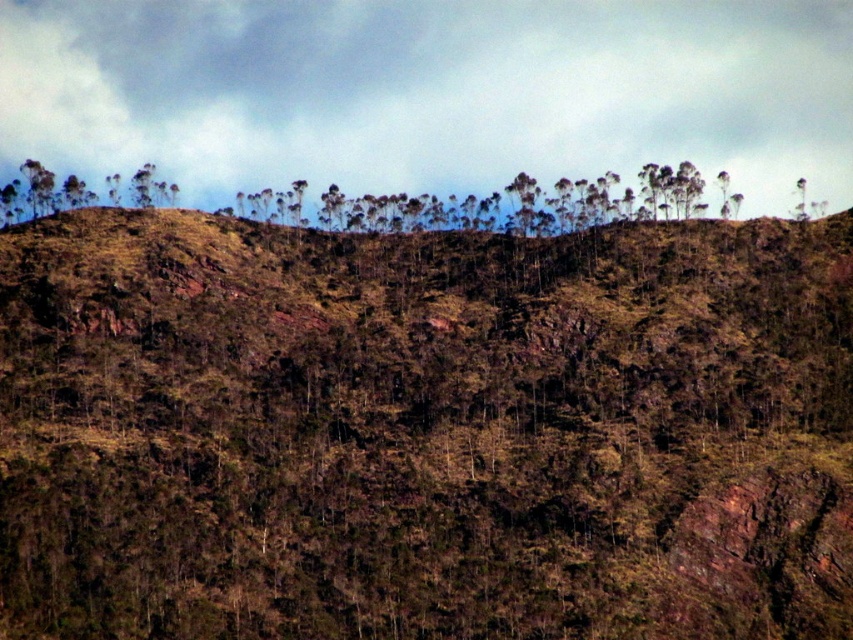
You are standing on the hillside and looking up. Which object, the brown rough hillside at upper center or the cloudy sky at upper center, takes up more visual space in your view?

The brown rough hillside at upper center takes up more visual space than the cloudy sky at upper center because it is bigger.

You are a hiker standing on the brown rough hillside at upper center and looking upward. You see the cloudy sky at upper center. Which object is closer to your eyes?

The brown rough hillside at upper center is closer to your eyes because it is in front of the cloudy sky at upper center.

You are a hiker standing at the base of the brown rough hillside at upper center and looking towards the cloudy sky at upper center. Which one is higher from your viewpoint?

The cloudy sky at upper center is higher than the brown rough hillside at upper center because the brown rough hillside at upper center is shorter than the cloudy sky at upper center.